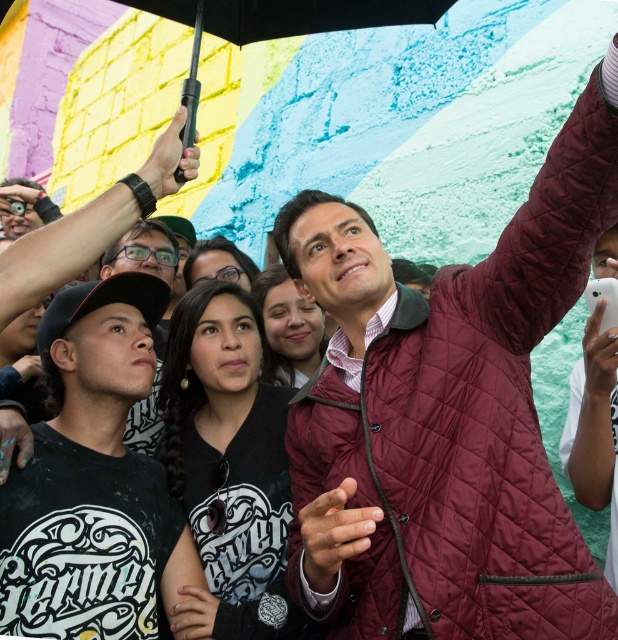
You are standing in front of the vibrant mural and notice a point marked at coordinates (446, 416). Which object from the scene is located at that point?

The point at coordinates (446, 416) indicates the maroon quilted jacket at upper right.

You are standing in front of the mural and see two points marked in the image. Which point, point [536,518] or point [143,630], is closer to you?

Point [536,518] is closer to the viewer than point [143,630].